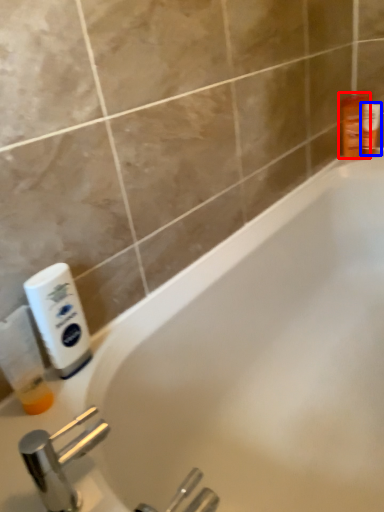
Question: Among these objects, which one is nearest to the camera, toiletry (highlighted by a red box) or toiletry (highlighted by a blue box)?

Choices:
 (A) toiletry
 (B) toiletry

Answer: (A)